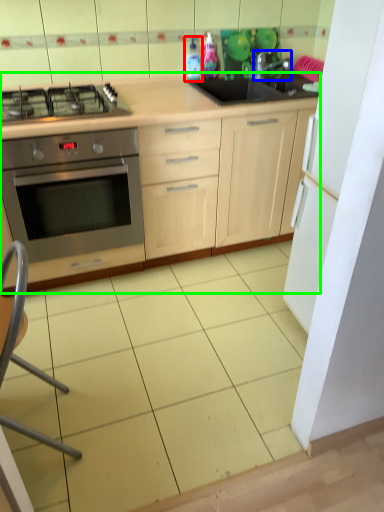
Question: Based on their relative distances, which object is farther from bottle (highlighted by a red box)? Choose from tap (highlighted by a blue box) and cabinetry (highlighted by a green box).

Choices:
 (A) tap
 (B) cabinetry

Answer: (B)